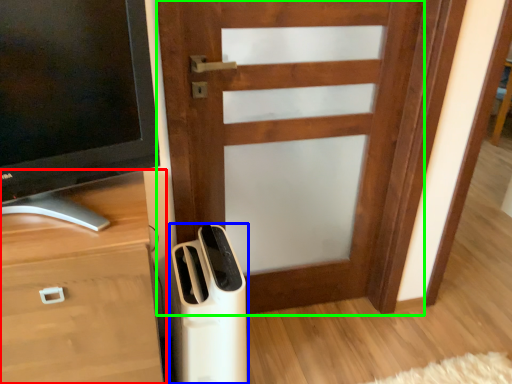
Question: Which is nearer to the chest of drawers (highlighted by a red box)? home appliance (highlighted by a blue box) or door (highlighted by a green box).

Choices:
 (A) home appliance
 (B) door

Answer: (A)